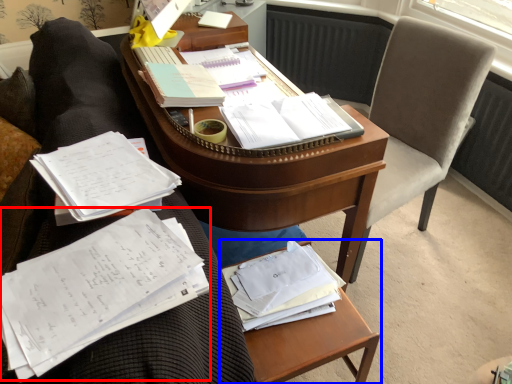
Question: Which object is closer to the camera taking this photo, document (highlighted by a red box) or table (highlighted by a blue box)?

Choices:
 (A) document
 (B) table

Answer: (A)